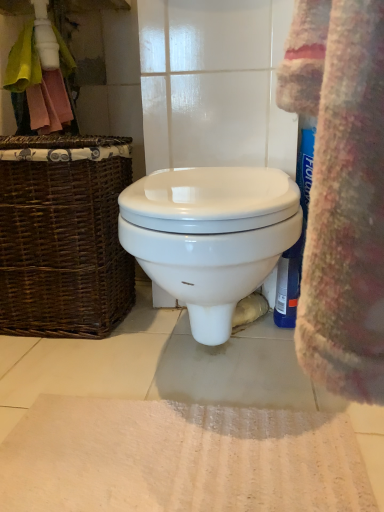
Question: Looking at their shapes, would you say brown wicker picnic basket at left is wider or thinner than white glossy toilet at center?

Choices:
 (A) wide
 (B) thin

Answer: (B)

Question: Relative to white glossy toilet at center, is brown wicker picnic basket at left in front or behind?

Choices:
 (A) front
 (B) behind

Answer: (B)

Question: Estimate the real-world distances between objects in this image. Which object is farther from the white glossy toilet at center?

Choices:
 (A) brown wicker picnic basket at left
 (B) white textured bath mat at lower center

Answer: (B)

Question: Which is nearer to the white textured bath mat at lower center?

Choices:
 (A) white glossy toilet at center
 (B) brown wicker picnic basket at left

Answer: (A)